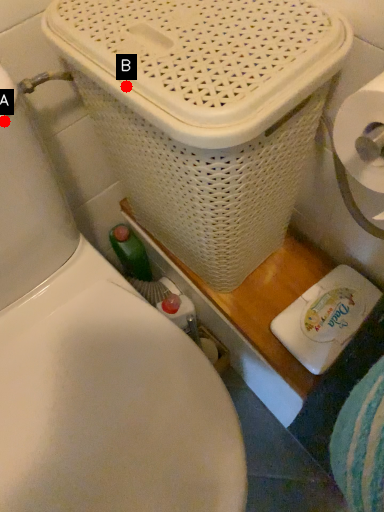
Question: Two points are circled on the image, labeled by A and B beside each circle. Among these points, which one is farthest from the camera?

Choices:
 (A) A is further
 (B) B is further

Answer: (A)